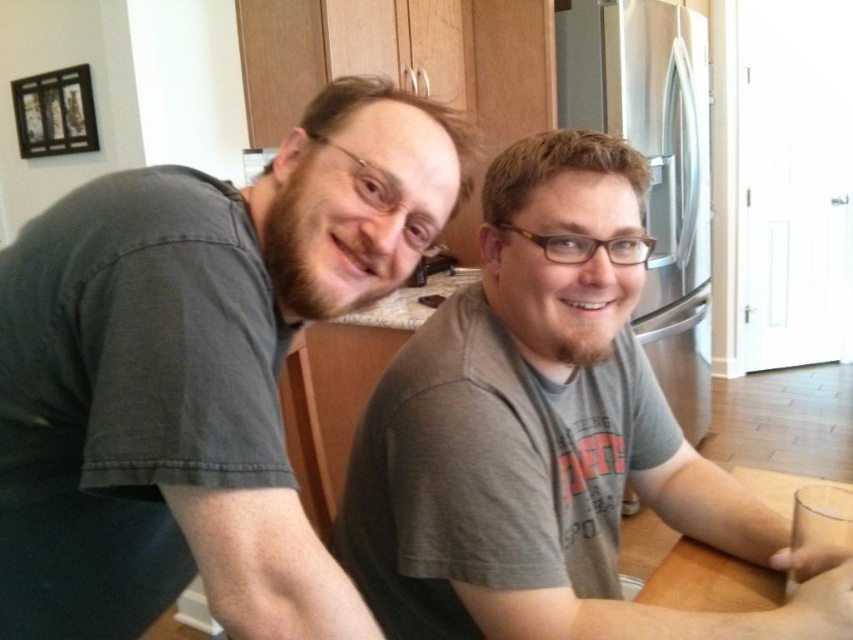
Question: Considering the real-world distances, which object is closest to the gray cotton t-shirt at center?

Choices:
 (A) white laminate counter top at center
 (B) wooden table at lower right

Answer: (B)

Question: Does white laminate counter top at center appear under wooden table at lower right?

Choices:
 (A) yes
 (B) no

Answer: (B)

Question: Is gray cotton t-shirt at center wider than white laminate counter top at center?

Choices:
 (A) no
 (B) yes

Answer: (B)

Question: Does gray cotton t-shirt at center have a greater width compared to wooden table at lower right?

Choices:
 (A) yes
 (B) no

Answer: (A)

Question: Which point is closer to the camera?

Choices:
 (A) gray cotton t-shirt at center
 (B) white laminate counter top at center
 (C) dark gray t-shirt at left
 (D) wooden table at lower right

Answer: (C)

Question: Which point is farther to the camera?

Choices:
 (A) white laminate counter top at center
 (B) dark gray t-shirt at left
 (C) wooden table at lower right

Answer: (A)